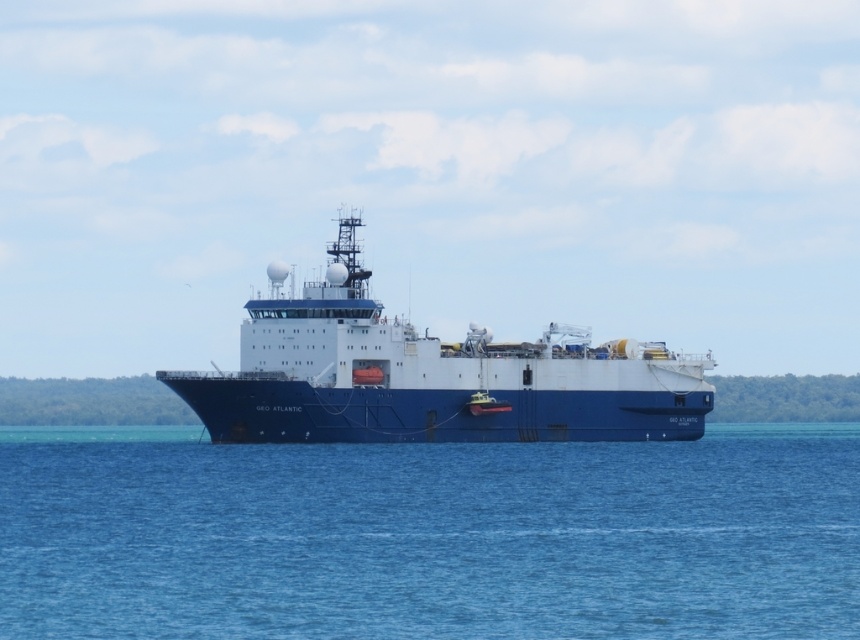
Question: Where is blue liquid water at center located in relation to blue matte ship at center in the image?

Choices:
 (A) left
 (B) right

Answer: (A)

Question: In this image, where is blue liquid water at center located relative to blue matte ship at center?

Choices:
 (A) below
 (B) above

Answer: (A)

Question: Which point is closer to the camera?

Choices:
 (A) (150, 508)
 (B) (219, 374)

Answer: (A)

Question: Is blue liquid water at center below blue matte ship at center?

Choices:
 (A) yes
 (B) no

Answer: (A)